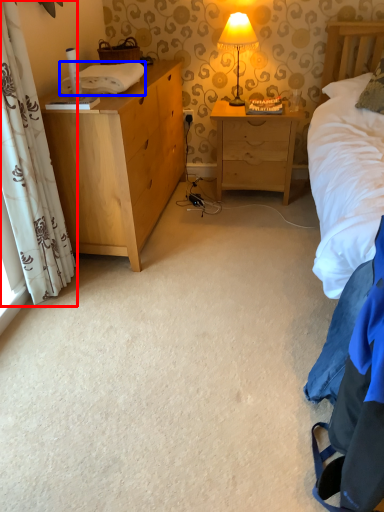
Question: Which object appears closest to the camera in this image, curtain (highlighted by a red box) or cloth (highlighted by a blue box)?

Choices:
 (A) curtain
 (B) cloth

Answer: (A)